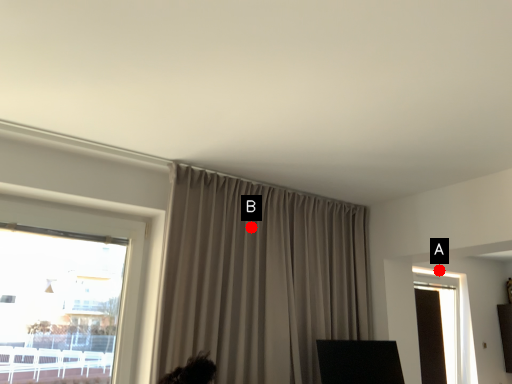
Question: Two points are circled on the image, labeled by A and B beside each circle. Which point is closer to the camera?

Choices:
 (A) A is closer
 (B) B is closer

Answer: (B)